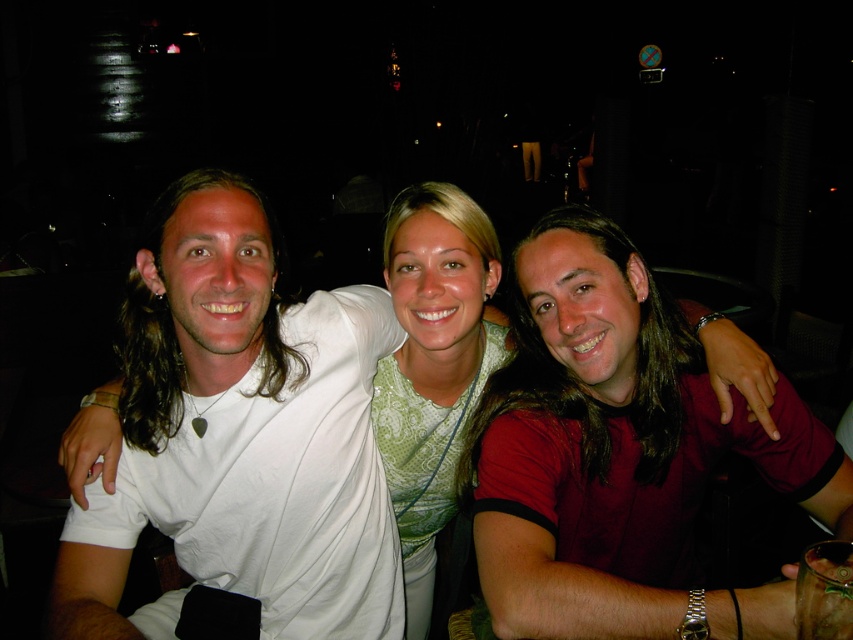
Question: Where is white matte t-shirt at left located in relation to green lace top at center in the image?

Choices:
 (A) right
 (B) left

Answer: (B)

Question: Is white matte t-shirt at left behind green lace top at center?

Choices:
 (A) yes
 (B) no

Answer: (B)

Question: Does white matte t-shirt at left appear under green lace top at center?

Choices:
 (A) no
 (B) yes

Answer: (A)

Question: Among these points, which one is nearest to the camera?

Choices:
 (A) (498, 356)
 (B) (265, 268)

Answer: (B)

Question: Among these points, which one is nearest to the camera?

Choices:
 (A) pyautogui.click(x=448, y=314)
 (B) pyautogui.click(x=235, y=454)

Answer: (B)

Question: Which of the following is the closest to the observer?

Choices:
 (A) (387, 224)
 (B) (67, 554)

Answer: (B)